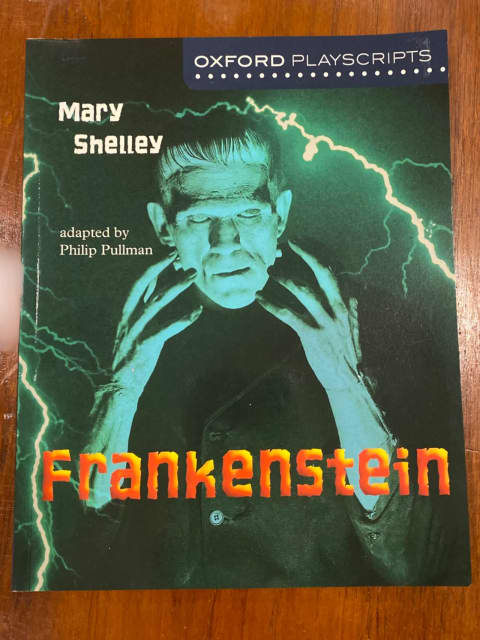
Where is `tabletop`? tabletop is located at coordinates (303, 127), (329, 614).